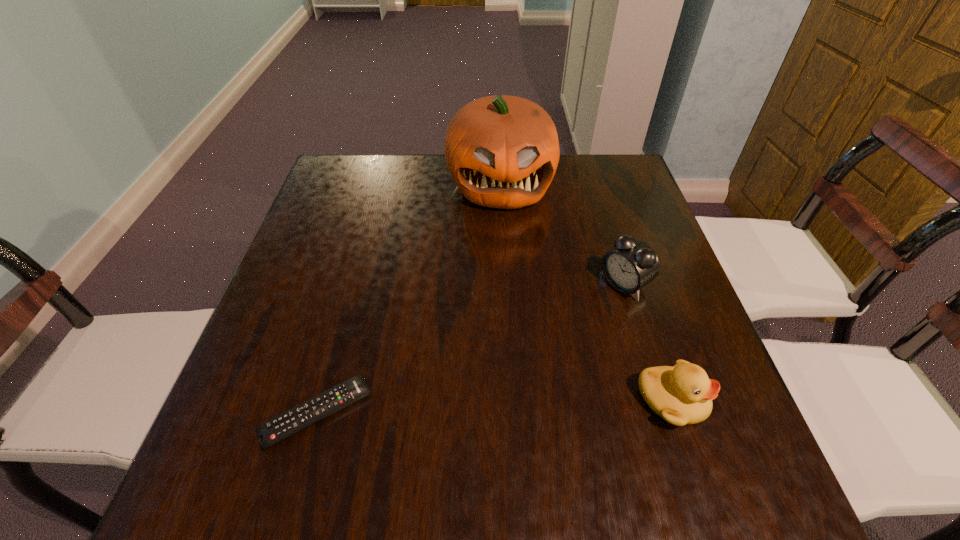
At what (x,y) coordinates should I click in order to perform the action: click on free space between the third nearest object and the tallest object. Please return your answer as a coordinate pair (x, y). Looking at the image, I should click on (563, 234).

The image size is (960, 540). What are the coordinates of `free space between the duckling and the second farthest object` in the screenshot? It's located at (648, 342).

Locate an element on the screen. The height and width of the screenshot is (540, 960). vacant space that is in between the remote control and the second shortest object is located at coordinates (494, 407).

What are the coordinates of `vacant space that's between the shortest object and the farthest object` in the screenshot? It's located at (409, 299).

Find the location of a particular element. The width and height of the screenshot is (960, 540). vacant area between the second tallest object and the pumpkin is located at coordinates (563, 234).

Identify the location of blank region between the shortest object and the tallest object. Image resolution: width=960 pixels, height=540 pixels. (409, 299).

The image size is (960, 540). Identify the location of empty space between the remote control and the duckling. (494, 407).

Where is `free point between the shortest object and the third nearest object`? The image size is (960, 540). free point between the shortest object and the third nearest object is located at coordinates (470, 349).

Locate an element on the screen. the third closest object to the second tallest object is located at coordinates (271, 432).

Locate which object is the second closest to the farthest object. Please provide its 2D coordinates. Your answer should be formatted as a tuple, i.e. [(x, y)], where the tuple contains the x and y coordinates of a point satisfying the conditions above.

[(682, 395)]